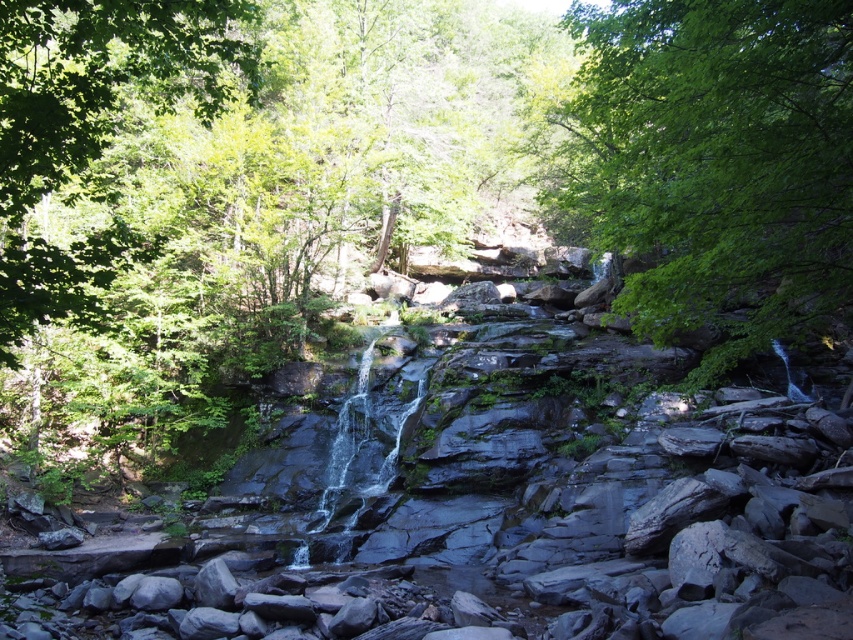
Who is lower down, green leafy tree at center or green leafy tree at upper left?

green leafy tree at upper left

Looking at this image, can you confirm if green leafy tree at center is positioned below green leafy tree at upper left?

Incorrect, green leafy tree at center is not positioned below green leafy tree at upper left.

Which is in front, point (695, 296) or point (0, 102)?

Point (0, 102) is more forward.

Locate an element on the screen. The image size is (853, 640). green leafy tree at center is located at coordinates (717, 161).